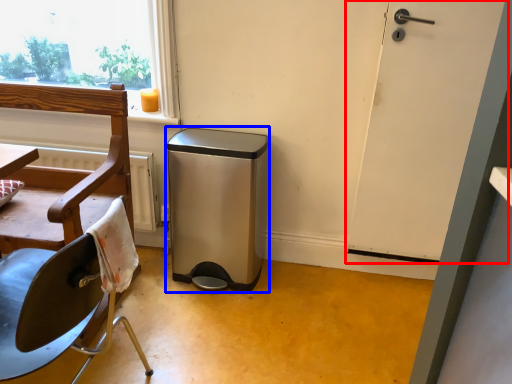
Question: Which object appears closest to the camera in this image, door (highlighted by a red box) or dish washer (highlighted by a blue box)?

Choices:
 (A) door
 (B) dish washer

Answer: (A)